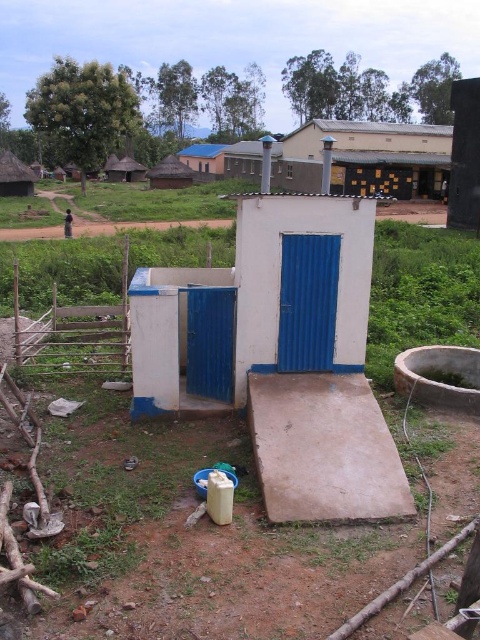
Question: Is dark brown wooden hut at upper center closer to camera compared to thatched straw hut at upper left?

Choices:
 (A) no
 (B) yes

Answer: (B)

Question: Does dark brown wooden hut at upper center come behind thatched straw hut at upper left?

Choices:
 (A) no
 (B) yes

Answer: (A)

Question: Which of the following is the farthest from the observer?

Choices:
 (A) (189, 160)
 (B) (132, 164)
 (C) (0, 177)

Answer: (A)

Question: Among these objects, which one is farthest from the camera?

Choices:
 (A) thatched straw hut at upper left
 (B) dark brown wooden hut at upper center
 (C) thatched straw hut at left
 (D) blue corrugated metal hut at center

Answer: (A)

Question: Which object is positioned farthest from the dark brown wooden hut at upper center?

Choices:
 (A) blue corrugated metal hut at center
 (B) thatched straw hut at left

Answer: (B)

Question: Can you confirm if dark brown wooden hut at upper center is bigger than thatched straw hut at left?

Choices:
 (A) no
 (B) yes

Answer: (B)